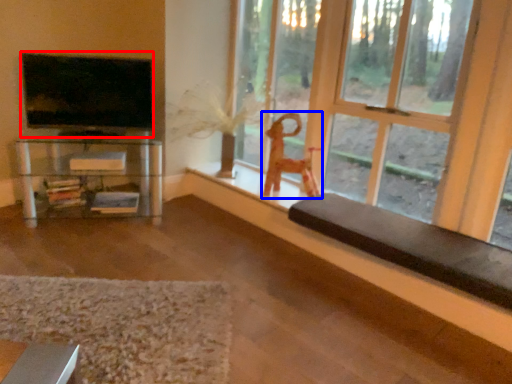
Question: Which of the following is the closest to the observer, television (highlighted by a red box) or toy (highlighted by a blue box)?

Choices:
 (A) television
 (B) toy

Answer: (A)